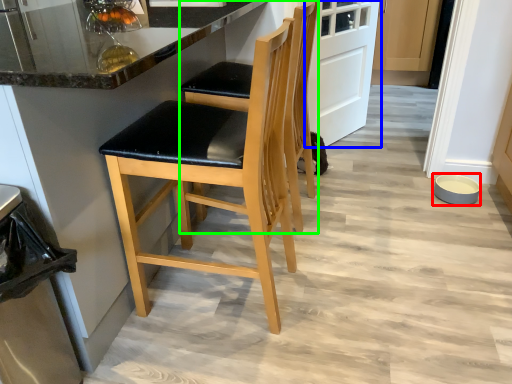
Question: Which object is the farthest from bowl (highlighted by a red box)? Choose among these: door (highlighted by a blue box) or chair (highlighted by a green box).

Choices:
 (A) door
 (B) chair

Answer: (B)